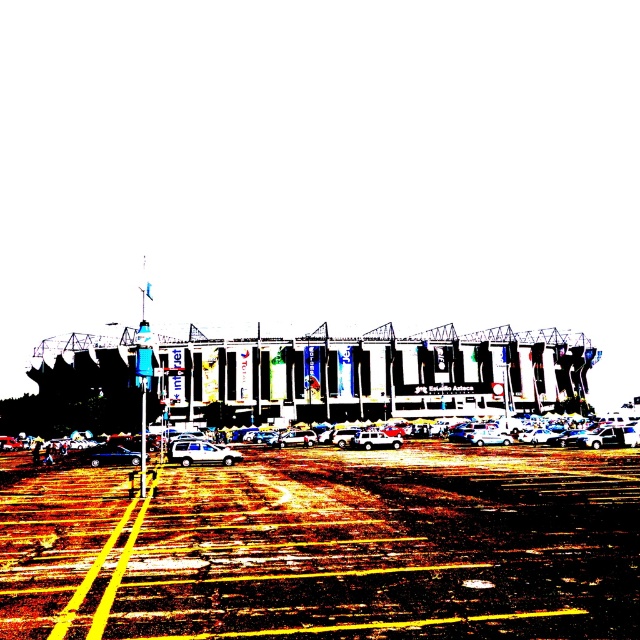
Question: Which is nearer to the brown asphalt parking lot at center?

Choices:
 (A) shiny metallic car at center
 (B) metallic silver suv at center

Answer: (A)

Question: Is white glossy car at center in front of metallic silver suv at center?

Choices:
 (A) yes
 (B) no

Answer: (A)

Question: Which point is closer to the camera?

Choices:
 (A) brown asphalt parking lot at center
 (B) metallic silver suv at center
 (C) shiny metallic car at center

Answer: (A)

Question: Does white glossy car at center have a greater width compared to shiny metallic car at center?

Choices:
 (A) yes
 (B) no

Answer: (B)

Question: Where is shiny metallic car at center located in relation to metallic silver suv at center in the image?

Choices:
 (A) right
 (B) left

Answer: (B)

Question: Which is farther from the brown asphalt parking lot at center?

Choices:
 (A) metallic silver suv at center
 (B) shiny metallic car at center
 (C) white glossy car at center

Answer: (A)